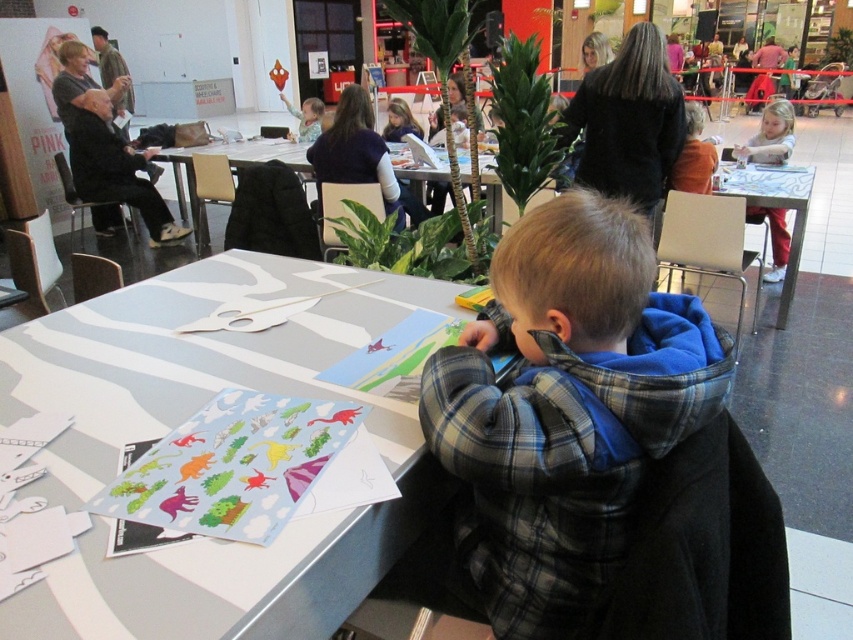
Is plaid flannel shirt at center taller than white glossy table at right?

In fact, plaid flannel shirt at center may be shorter than white glossy table at right.

Can you confirm if plaid flannel shirt at center is positioned to the left of white glossy table at right?

Correct, you'll find plaid flannel shirt at center to the left of white glossy table at right.

Does point (486, 564) come behind point (809, 189)?

No, (486, 564) is closer to viewer.

Where is `plaid flannel shirt at center`? This screenshot has height=640, width=853. plaid flannel shirt at center is located at coordinates (564, 410).

Is plaid flannel shirt at center thinner than white paper at center?

Correct, plaid flannel shirt at center's width is less than white paper at center's.

Can you confirm if plaid flannel shirt at center is smaller than white paper at center?

Yes.

The image size is (853, 640). Describe the element at coordinates (564, 410) in the screenshot. I see `plaid flannel shirt at center` at that location.

This screenshot has width=853, height=640. In order to click on plaid flannel shirt at center in this screenshot , I will do `click(564, 410)`.

Between white glossy table at right and orange sweater at upper right, which one has more height?

white glossy table at right is taller.

Who is lower down, white glossy table at right or orange sweater at upper right?

white glossy table at right is below.

Describe the element at coordinates (775, 208) in the screenshot. I see `white glossy table at right` at that location.

You are a GUI agent. You are given a task and a screenshot of the screen. Output one action in this format:
    pyautogui.click(x=<x>, y=<y>)
    Task: Click on the white glossy table at right
    Image resolution: width=853 pixels, height=640 pixels.
    Given the screenshot: What is the action you would take?
    coord(775,208)